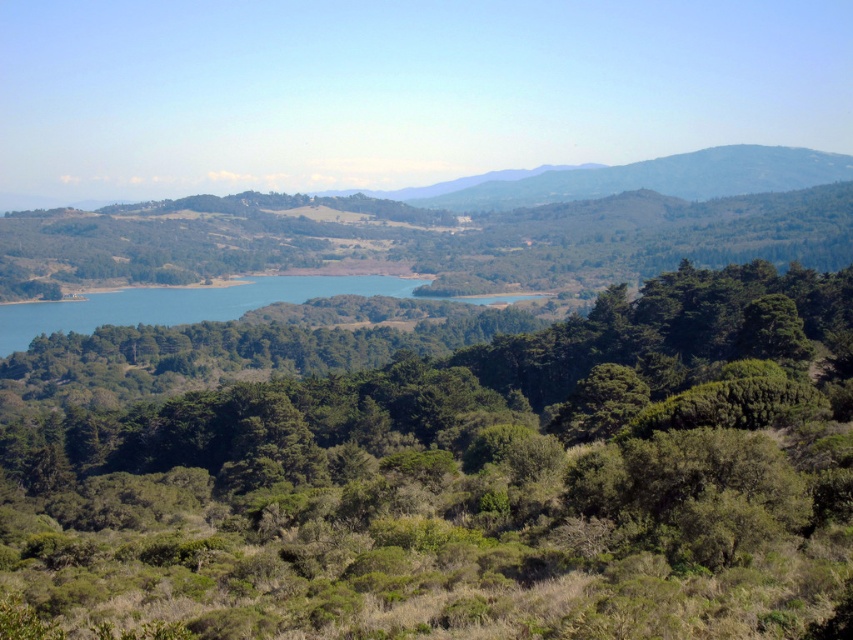
What do you see at coordinates (469, 484) in the screenshot?
I see `green leafy tree at center` at bounding box center [469, 484].

Where is `green leafy tree at center`? Image resolution: width=853 pixels, height=640 pixels. green leafy tree at center is located at coordinates (469, 484).

Where is `green leafy tree at center`? The height and width of the screenshot is (640, 853). green leafy tree at center is located at coordinates (469, 484).